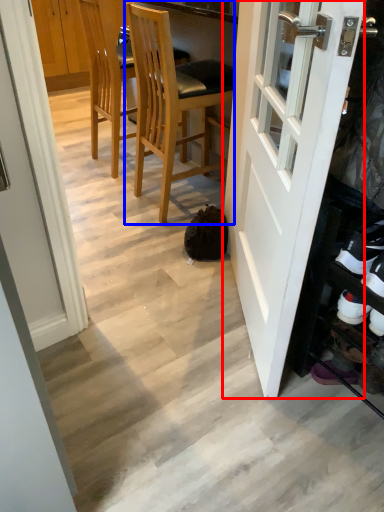
Question: Which of the following is the closest to the observer, door (highlighted by a red box) or chair (highlighted by a blue box)?

Choices:
 (A) door
 (B) chair

Answer: (A)